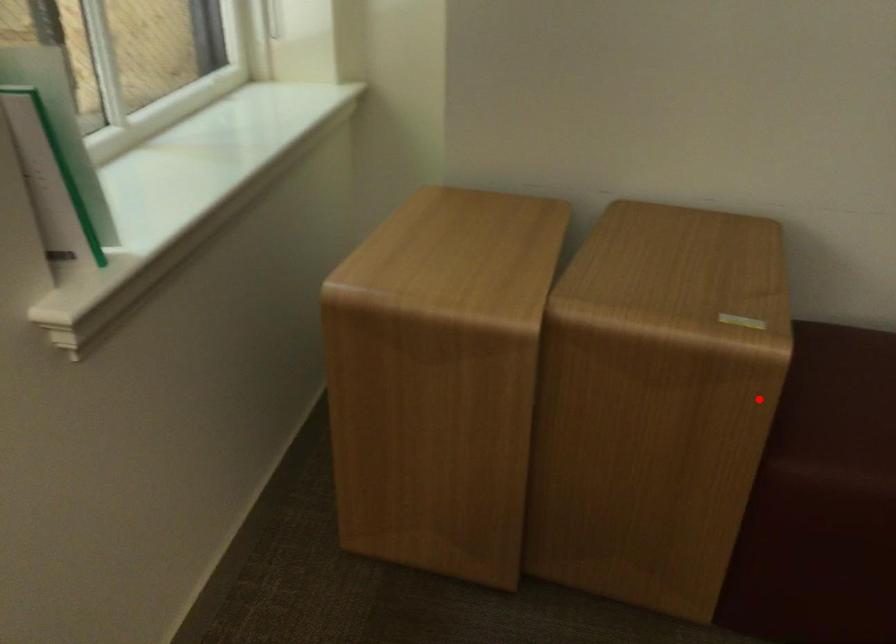
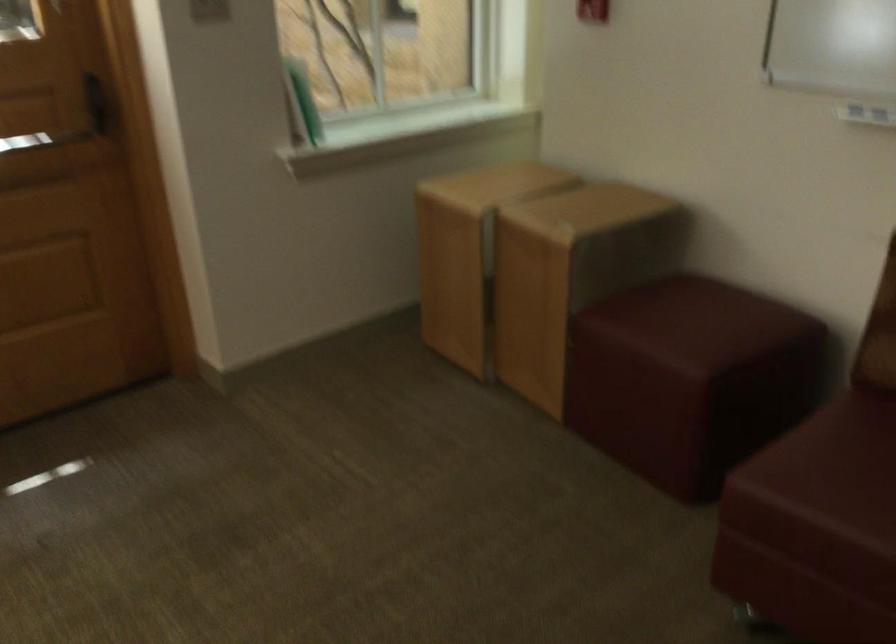
The point at the highlighted location is marked in the first image. Where is the corresponding point in the second image?

(570, 272)